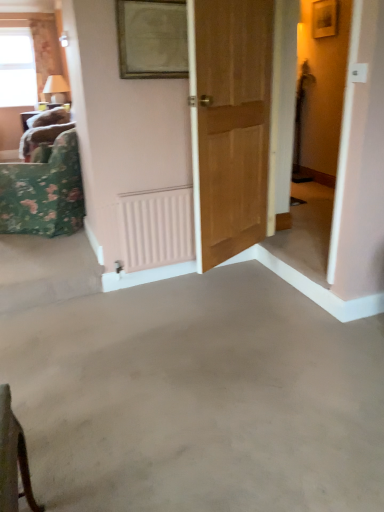
Question: Is clear glass window at upper left thinner than floral fabric cushion at left?

Choices:
 (A) yes
 (B) no

Answer: (A)

Question: Is the surface of clear glass window at upper left in direct contact with floral fabric cushion at left?

Choices:
 (A) yes
 (B) no

Answer: (B)

Question: From the image's perspective, is clear glass window at upper left located beneath floral fabric cushion at left?

Choices:
 (A) yes
 (B) no

Answer: (B)

Question: Is clear glass window at upper left at the right side of floral fabric cushion at left?

Choices:
 (A) yes
 (B) no

Answer: (B)

Question: Can you confirm if clear glass window at upper left is bigger than floral fabric cushion at left?

Choices:
 (A) no
 (B) yes

Answer: (A)

Question: Is gold-framed mirror at upper center wider or thinner than floral fabric cushion at left?

Choices:
 (A) wide
 (B) thin

Answer: (B)

Question: Considering the positions of gold-framed mirror at upper center and floral fabric cushion at left in the image, is gold-framed mirror at upper center bigger or smaller than floral fabric cushion at left?

Choices:
 (A) big
 (B) small

Answer: (B)

Question: Is gold-framed mirror at upper center to the left or to the right of floral fabric cushion at left in the image?

Choices:
 (A) right
 (B) left

Answer: (A)

Question: Does point (183, 2) appear closer or farther from the camera than point (52, 236)?

Choices:
 (A) closer
 (B) farther

Answer: (A)

Question: From a real-world perspective, is floral fabric cushion at left positioned above or below pink matte radiator at center?

Choices:
 (A) above
 (B) below

Answer: (A)

Question: In terms of height, does floral fabric cushion at left look taller or shorter compared to pink matte radiator at center?

Choices:
 (A) tall
 (B) short

Answer: (A)

Question: Is floral fabric cushion at left wider or thinner than pink matte radiator at center?

Choices:
 (A) wide
 (B) thin

Answer: (A)

Question: Considering the positions of floral fabric cushion at left and pink matte radiator at center in the image, is floral fabric cushion at left bigger or smaller than pink matte radiator at center?

Choices:
 (A) small
 (B) big

Answer: (B)

Question: Looking at their shapes, would you say floral fabric curtain at upper left is wider or thinner than wooden door at center?

Choices:
 (A) wide
 (B) thin

Answer: (A)

Question: Is point (56, 65) positioned closer to the camera than point (236, 83)?

Choices:
 (A) closer
 (B) farther

Answer: (B)